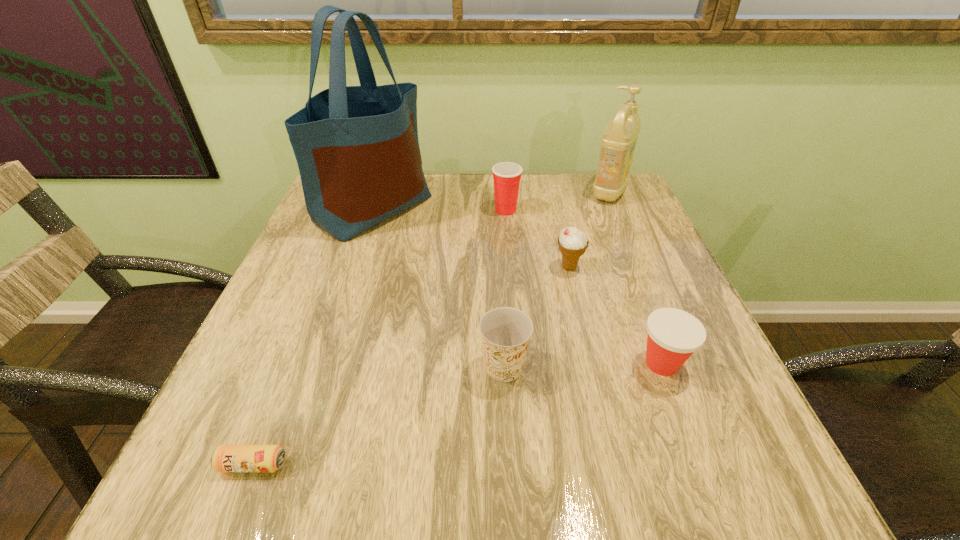
Find the location of a particular element. The height and width of the screenshot is (540, 960). the tallest object is located at coordinates (357, 149).

This screenshot has width=960, height=540. I want to click on detergent, so click(x=618, y=142).

At what (x,y) coordinates should I click in order to perform the action: click on the farthest Dixie cup. Please return your answer as a coordinate pair (x, y). The height and width of the screenshot is (540, 960). Looking at the image, I should click on (507, 175).

Where is `the fourth farthest object`? Image resolution: width=960 pixels, height=540 pixels. the fourth farthest object is located at coordinates (572, 242).

This screenshot has height=540, width=960. Identify the location of the third object from right to left. (572, 242).

The image size is (960, 540). I want to click on the rightmost Dixie cup, so click(673, 335).

Where is `the nearest object`? Image resolution: width=960 pixels, height=540 pixels. the nearest object is located at coordinates (226, 458).

Identify the location of beer can. (226, 458).

This screenshot has height=540, width=960. In order to click on vacant area situated on the right of the tallest object in this screenshot , I will do `click(475, 208)`.

Image resolution: width=960 pixels, height=540 pixels. In order to click on free space located on the left of the second tallest object in this screenshot , I will do `click(501, 191)`.